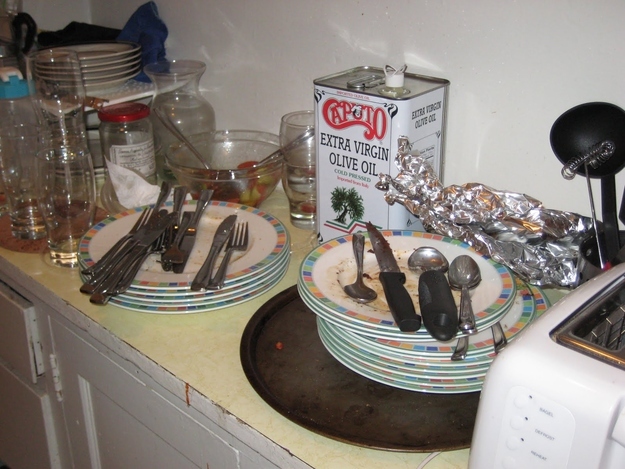
Locate an element on the screen. The width and height of the screenshot is (625, 469). wall is located at coordinates (281, 49).